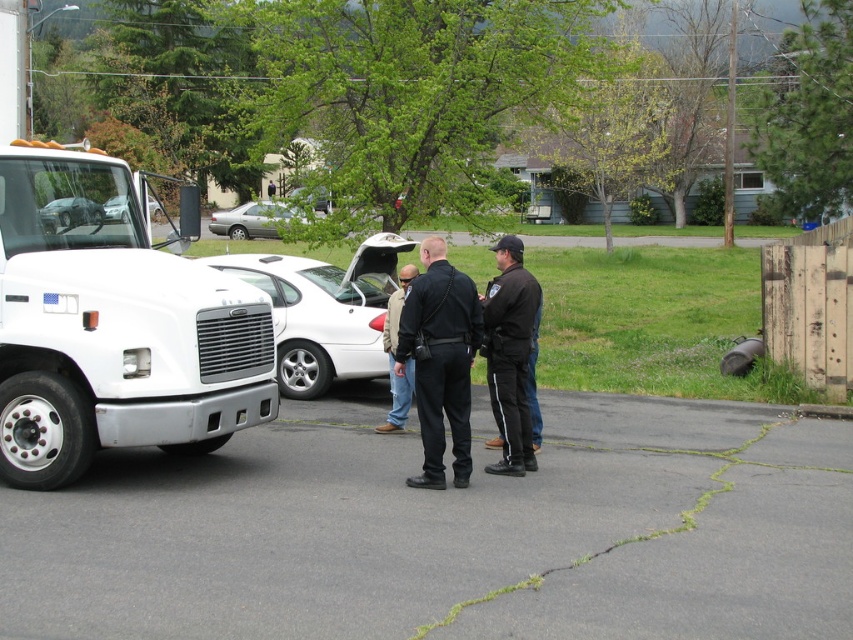
Is white glossy sedan at center positioned behind matte white sedan at center?

Yes, white glossy sedan at center is further from the viewer.

What do you see at coordinates (323, 310) in the screenshot? This screenshot has height=640, width=853. I see `white glossy sedan at center` at bounding box center [323, 310].

Is point (329, 333) positioned before point (71, 202)?

No, (329, 333) is further to viewer.

The width and height of the screenshot is (853, 640). I want to click on white glossy sedan at center, so click(x=323, y=310).

Does black smooth jacket at center appear under khaki pants at center?

Yes, black smooth jacket at center is below khaki pants at center.

Which is below, black smooth jacket at center or khaki pants at center?

Positioned lower is black smooth jacket at center.

At what (x,y) coordinates should I click in order to perform the action: click on black smooth jacket at center. Please return your answer as a coordinate pair (x, y). The width and height of the screenshot is (853, 640). Looking at the image, I should click on (509, 355).

Who is positioned more to the right, black smooth jacket at center or silver metallic sedan at center?

From the viewer's perspective, black smooth jacket at center appears more on the right side.

Who is more forward, (x=485, y=349) or (x=265, y=204)?

Point (x=485, y=349) is in front.

You are a GUI agent. You are given a task and a screenshot of the screen. Output one action in this format:
    pyautogui.click(x=<x>, y=<y>)
    Task: Click on the black smooth jacket at center
    
    Given the screenshot: What is the action you would take?
    pyautogui.click(x=509, y=355)